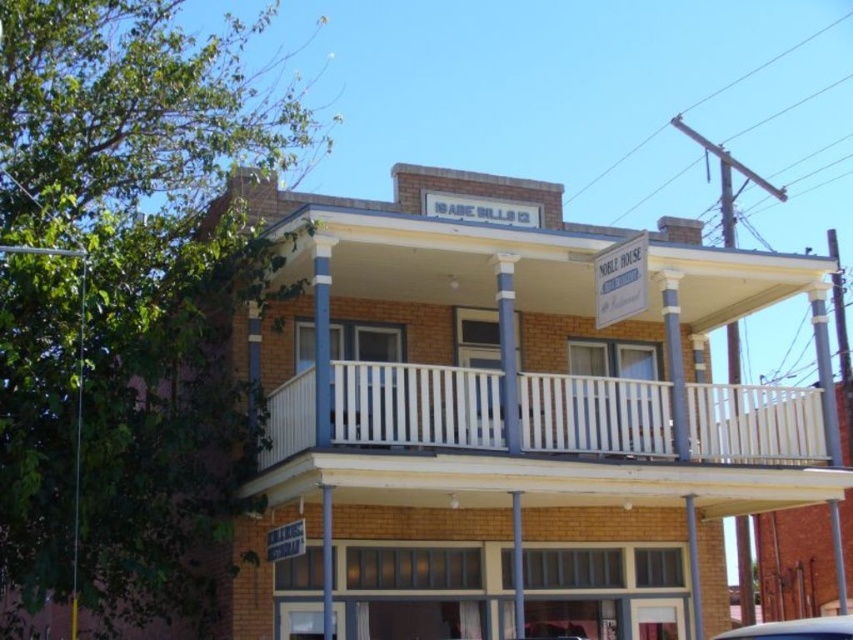
Is white glossy car at lower right bigger than metallic silver sign at lower center?

Indeed, white glossy car at lower right has a larger size compared to metallic silver sign at lower center.

Between white glossy car at lower right and metallic silver sign at lower center, which one appears on the left side from the viewer's perspective?

metallic silver sign at lower center is more to the left.

Is point (773, 634) closer to camera compared to point (303, 538)?

That is True.

The height and width of the screenshot is (640, 853). Identify the location of white glossy car at lower right. (793, 628).